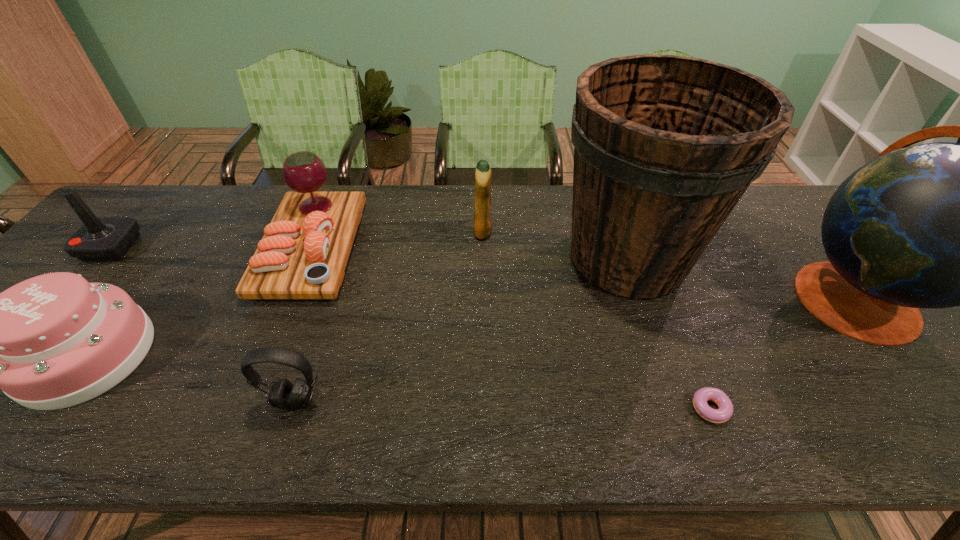
What are the coordinates of `bucket` in the screenshot? It's located at (665, 146).

This screenshot has height=540, width=960. In order to click on detergent in this screenshot , I will do `click(482, 203)`.

This screenshot has height=540, width=960. I want to click on platter, so click(x=303, y=254).

The width and height of the screenshot is (960, 540). Identify the location of joystick. (99, 238).

The image size is (960, 540). What are the coordinates of `headset` in the screenshot? It's located at (284, 395).

At what (x,y) coordinates should I click in order to perform the action: click on doughnut. Please return your answer as a coordinate pair (x, y). Looking at the image, I should click on (724, 412).

You are a GUI agent. You are given a task and a screenshot of the screen. Output one action in this format:
    pyautogui.click(x=<x>, y=<y>)
    Task: Click on the free region located 0.050m on the back of the bucket
    
    Given the screenshot: What is the action you would take?
    pyautogui.click(x=608, y=202)

Where is `vacant region located 0.230m on the label of the detergent`? The image size is (960, 540). vacant region located 0.230m on the label of the detergent is located at coordinates (395, 231).

Where is `vacant region located on the label of the detergent`? This screenshot has height=540, width=960. vacant region located on the label of the detergent is located at coordinates (408, 231).

Where is `free space located on the label of the detergent`? This screenshot has height=540, width=960. free space located on the label of the detergent is located at coordinates pyautogui.click(x=425, y=231).